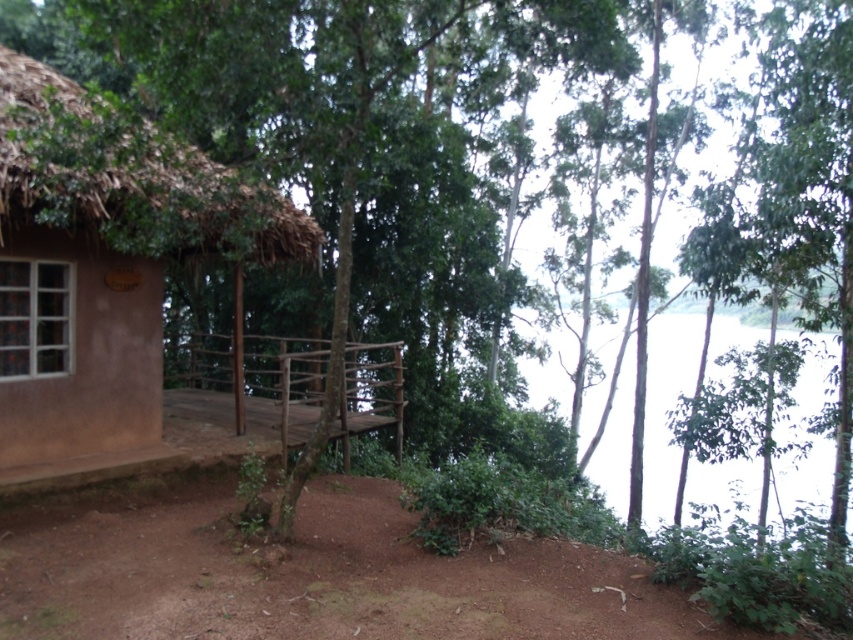
You are standing in front of the rustic hut and want to determine the relative positions of two points marked in the scene. Which point, point (22, 365) or point (397, 412), is closer to you?

Point (22, 365) is closer to the camera than point (397, 412).

From the picture: You are standing at the base of the slope and see the brown clay hut at left and the wooden at center. Which structure is closer to your current position?

The brown clay hut at left is closer to your current position because it is positioned to the left of the wooden at center, which is further to the right.

Looking at this image, you are standing on the wooden at center and want to reach the brown clay hut at left. Which direction should you move to get there?

The brown clay hut at left is positioned over wooden at center, so you should move upward to reach the brown clay hut at left.